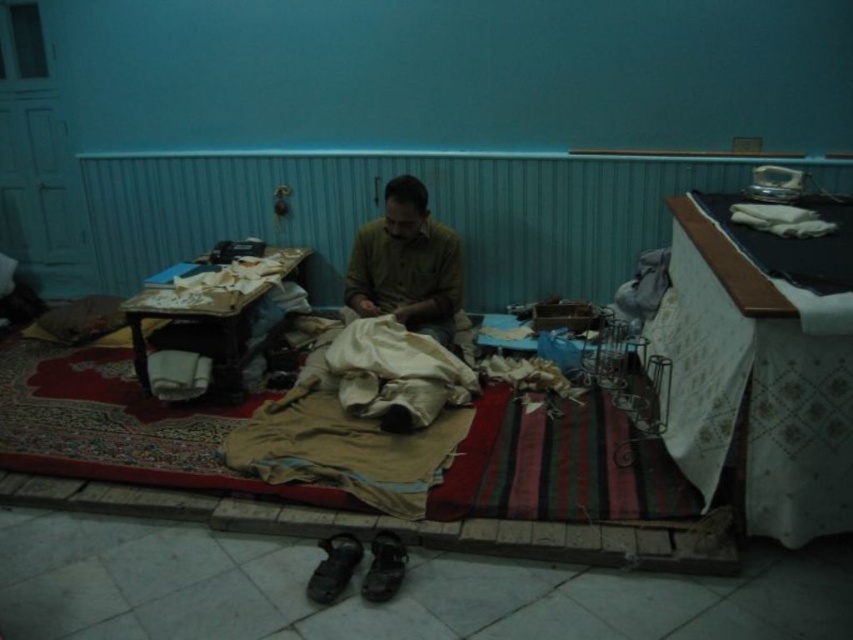
You are organizing a small closet and need to place the brown cotton shirt at center and the dark brown leather sandal at lower center. According to their positions in the image, which item is located to the right of the other?

The brown cotton shirt at center is positioned on the right side of dark brown leather sandal at lower center, so the shirt is to the right of the sandal.

From the picture: You are a delivery person who needs to place a package on the floor near the dark brown leather shoe at lower center. However, you must ensure that the package doesn not block the brown cotton shirt at center. Can you do this?

The brown cotton shirt at center is above the dark brown leather shoe at lower center, so placing the package near the dark brown leather shoe at lower center on the floor will not block the shirt since it is positioned higher.